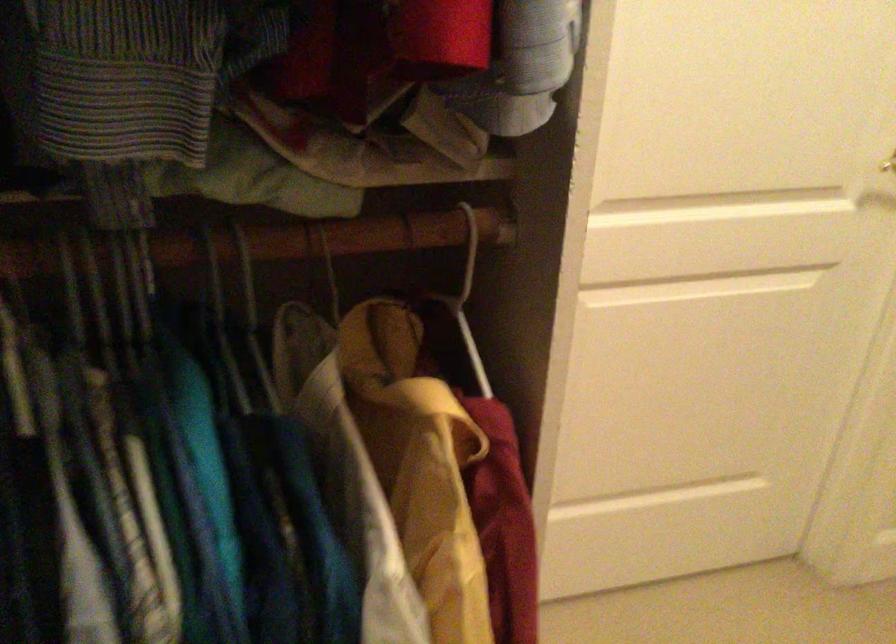
This screenshot has width=896, height=644. In order to click on white hanger hook in this screenshot , I will do `click(468, 254)`.